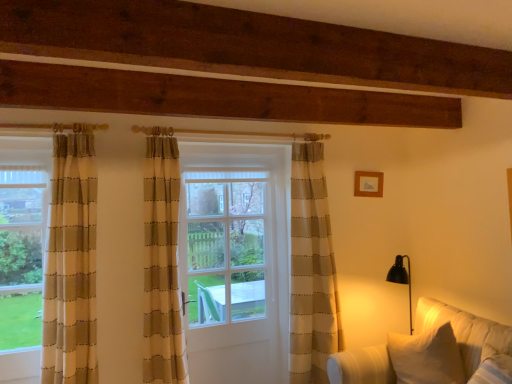
Question: Is white wooden door at center bigger than wooden picture frame at upper right?

Choices:
 (A) yes
 (B) no

Answer: (A)

Question: Can you confirm if white wooden door at center is taller than wooden picture frame at upper right?

Choices:
 (A) yes
 (B) no

Answer: (A)

Question: From a real-world perspective, is white wooden door at center below wooden picture frame at upper right?

Choices:
 (A) no
 (B) yes

Answer: (B)

Question: Does white wooden door at center have a smaller size compared to wooden picture frame at upper right?

Choices:
 (A) yes
 (B) no

Answer: (B)

Question: Is white wooden door at center closer to camera compared to wooden picture frame at upper right?

Choices:
 (A) no
 (B) yes

Answer: (B)

Question: Is white wooden door at center aimed at wooden picture frame at upper right?

Choices:
 (A) yes
 (B) no

Answer: (B)

Question: Is white fabric couch at lower right at the left side of wooden picture frame at upper right?

Choices:
 (A) yes
 (B) no

Answer: (B)

Question: Is white fabric couch at lower right positioned behind wooden picture frame at upper right?

Choices:
 (A) no
 (B) yes

Answer: (A)

Question: Considering the relative sizes of white fabric couch at lower right and wooden picture frame at upper right in the image provided, is white fabric couch at lower right wider than wooden picture frame at upper right?

Choices:
 (A) yes
 (B) no

Answer: (A)

Question: Can you confirm if white fabric couch at lower right is positioned to the right of wooden picture frame at upper right?

Choices:
 (A) yes
 (B) no

Answer: (A)

Question: Is the surface of white fabric couch at lower right in direct contact with wooden picture frame at upper right?

Choices:
 (A) yes
 (B) no

Answer: (B)

Question: Considering the relative sizes of white fabric couch at lower right and wooden picture frame at upper right in the image provided, is white fabric couch at lower right smaller than wooden picture frame at upper right?

Choices:
 (A) no
 (B) yes

Answer: (A)

Question: From a real-world perspective, is white fabric couch at lower right located higher than clear glass door at center?

Choices:
 (A) no
 (B) yes

Answer: (A)